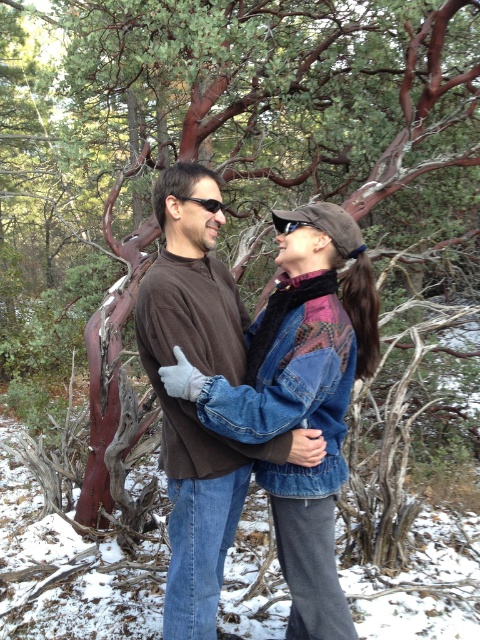
Question: Based on their relative distances, which object is farther from the black plastic sunglasses at upper center?

Choices:
 (A) clear plastic goggles at upper center
 (B) brown sweater at center

Answer: (B)

Question: Does brown sweater at center appear over clear plastic goggles at upper center?

Choices:
 (A) yes
 (B) no

Answer: (B)

Question: Which of the following is the farthest from the observer?

Choices:
 (A) clear plastic goggles at upper center
 (B) black plastic sunglasses at upper center
 (C) brown sweater at center

Answer: (B)

Question: Is brown sweater at center above black plastic sunglasses at upper center?

Choices:
 (A) yes
 (B) no

Answer: (B)

Question: Estimate the real-world distances between objects in this image. Which object is farther from the black plastic sunglasses at upper center?

Choices:
 (A) clear plastic goggles at upper center
 (B) brown sweater at center

Answer: (B)

Question: Is brown sweater at center below clear plastic goggles at upper center?

Choices:
 (A) yes
 (B) no

Answer: (A)